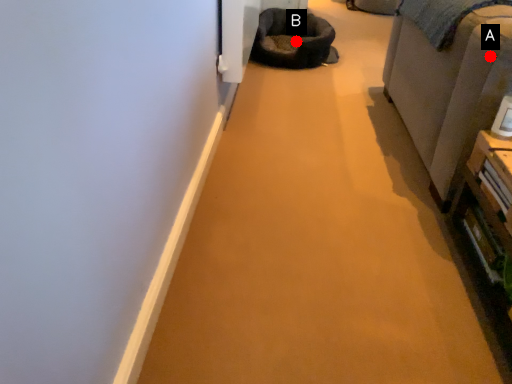
Question: Two points are circled on the image, labeled by A and B beside each circle. Which point is closer to the camera?

Choices:
 (A) A is closer
 (B) B is closer

Answer: (A)